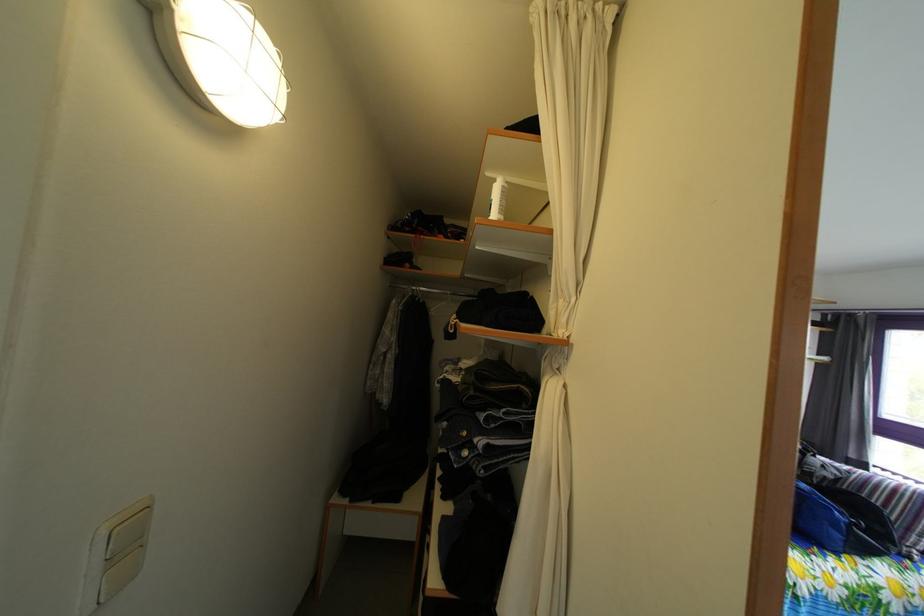
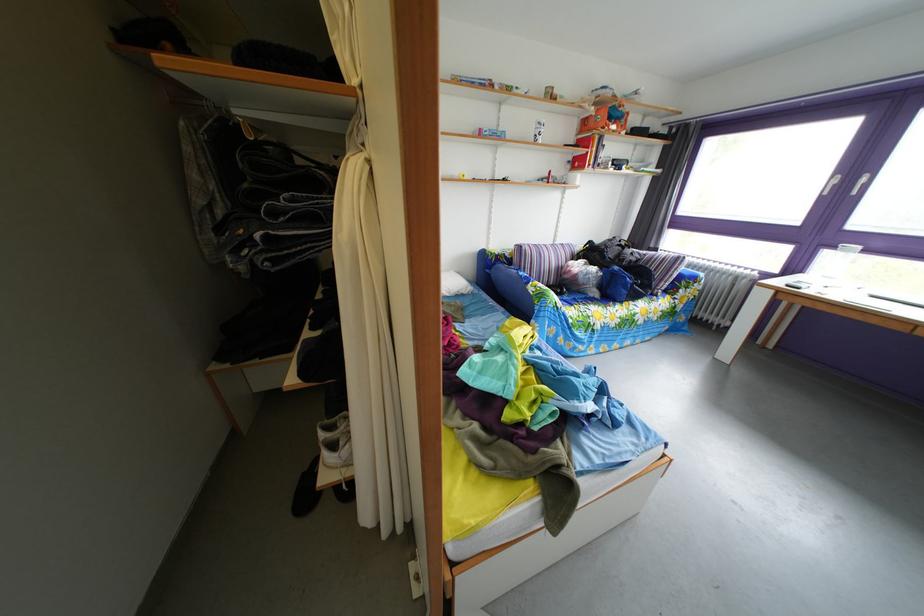
First-person continuous shooting, in which direction is the camera rotating?

The camera rotated toward right-down.